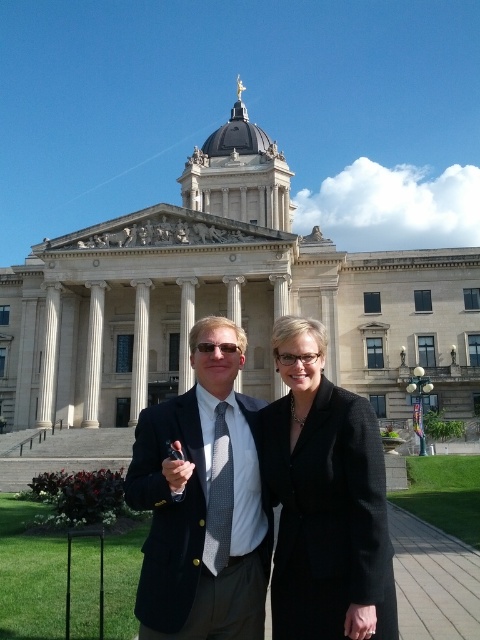
You are an architect examining the building facade. You notice the gray dotted tie at center and the white marble pillar at center. Which object is positioned higher on the image?

The white marble pillar at center is positioned higher than the gray dotted tie at center because the gray dotted tie at center is located below it.

You are a photographer trying to capture a photo of the gray dotted tie at center and the white marble pillar at center. Which object should you zoom in on to ensure both are clearly visible in the frame?

The gray dotted tie at center is smaller than the white marble pillar at center, so you should zoom in on the gray dotted tie at center to ensure both are clearly visible in the frame.

You are standing in front of the grand neoclassical building with two people. You notice two points marked on the ground at coordinates point (x=232, y=492) and point (x=86, y=381). Which point is closer to you, the observer?

Point (x=232, y=492) is in front of point (x=86, y=381), so it is closer to you.